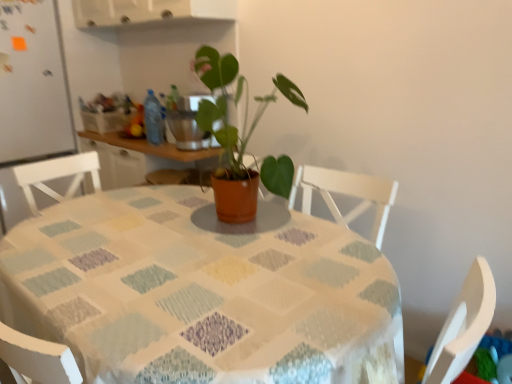
Question: Considering the positions of white matte refrigerator at left and matte terracotta pot at center in the image, is white matte refrigerator at left wider or thinner than matte terracotta pot at center?

Choices:
 (A) thin
 (B) wide

Answer: (B)

Question: Considering the relative positions of white matte refrigerator at left and matte terracotta pot at center in the image provided, is white matte refrigerator at left to the left or to the right of matte terracotta pot at center?

Choices:
 (A) right
 (B) left

Answer: (B)

Question: Which object is positioned farthest from the blue plastic bottle at center?

Choices:
 (A) textured fabric tablecloth at center
 (B) matte terracotta pot at center
 (C) white matte refrigerator at left

Answer: (A)

Question: Considering the real-world distances, which object is closest to the textured fabric tablecloth at center?

Choices:
 (A) blue plastic bottle at center
 (B) white matte refrigerator at left
 (C) matte terracotta pot at center

Answer: (C)